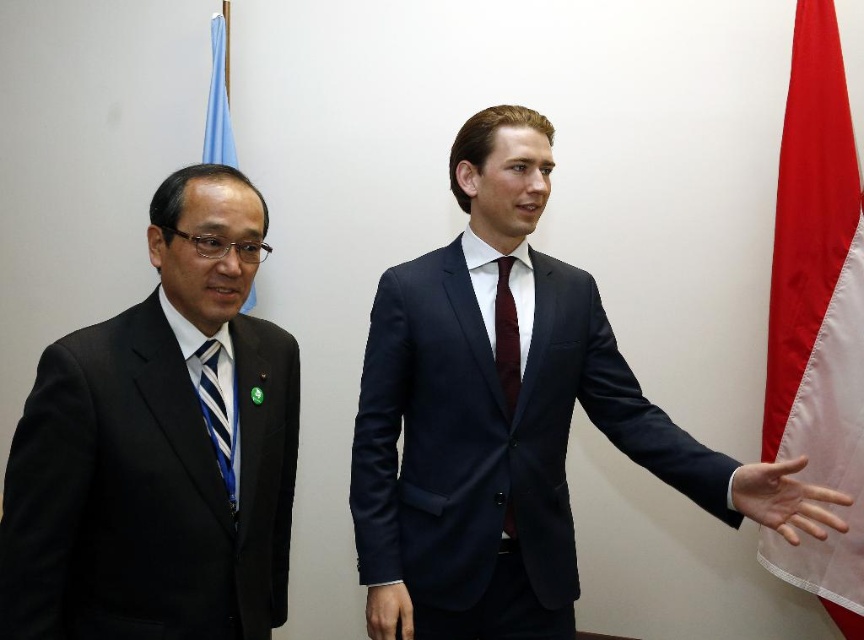
Measure the distance between black suit at left and camera.

black suit at left is 1.10 meters away from camera.

The width and height of the screenshot is (864, 640). I want to click on black suit at left, so click(x=160, y=448).

Between red/white fabric flag at right and blue fabric flag at upper left, which one is positioned lower?

red/white fabric flag at right is lower down.

This screenshot has height=640, width=864. What are the coordinates of `red/white fabric flag at right` in the screenshot? It's located at [x=818, y=314].

Does smooth skin hand at center come behind blue fabric flag at upper left?

No, it is in front of blue fabric flag at upper left.

Between smooth skin hand at center and blue fabric flag at upper left, which one appears on the left side from the viewer's perspective?

blue fabric flag at upper left is more to the left.

Identify the location of smooth skin hand at center. (785, 499).